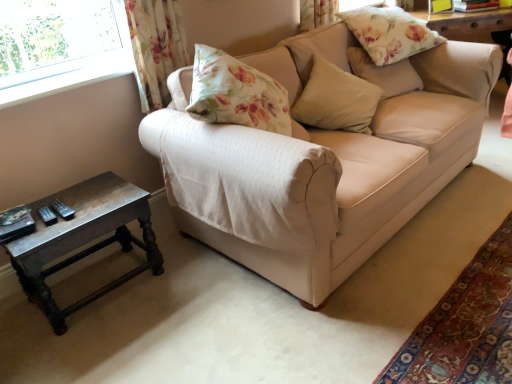
At what (x,y) coordinates should I click in order to perform the action: click on free space in front of dark brown wooden table at lower left. Please return your answer as a coordinate pair (x, y). This screenshot has height=384, width=512. Looking at the image, I should click on (102, 340).